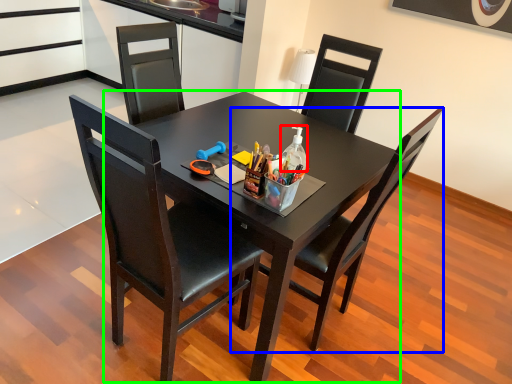
Question: Considering the real-world distances, which object is farthest from bottle (highlighted by a red box)? chair (highlighted by a blue box) or round table (highlighted by a green box)?

Choices:
 (A) chair
 (B) round table

Answer: (A)